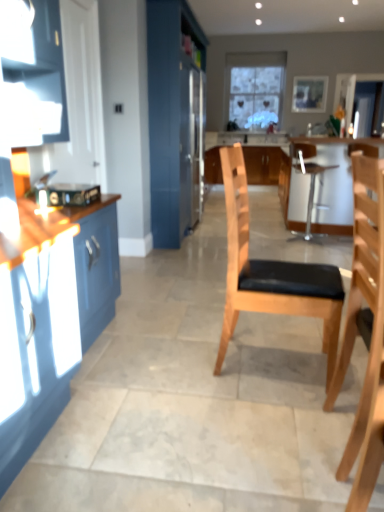
Find the location of a particular element. The image size is (384, 512). vacant location behind light wood/black cushioned chair at center, the 3th chair from the right is located at coordinates (258, 331).